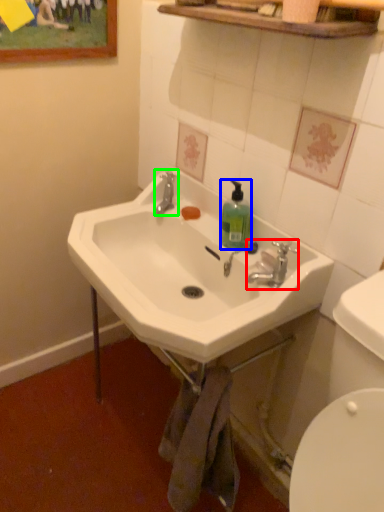
Question: Which object is positioned closest to plumbing fixture (highlighted by a red box)? Select from bottle (highlighted by a blue box) and plumbing fixture (highlighted by a green box).

Choices:
 (A) bottle
 (B) plumbing fixture

Answer: (A)